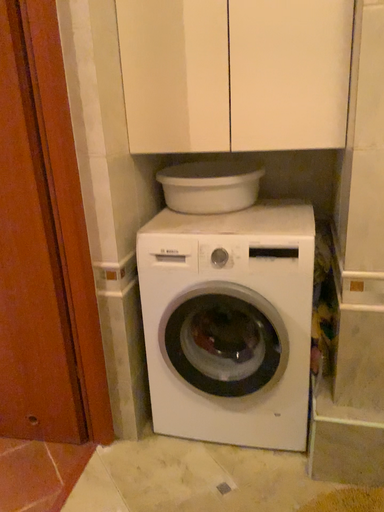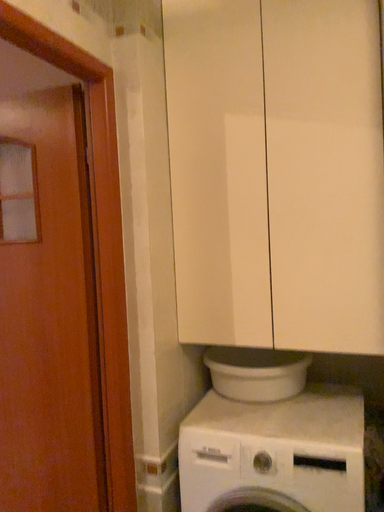
Question: How did the camera likely rotate when shooting the video?

Choices:
 (A) rotated right
 (B) rotated left

Answer: (B)